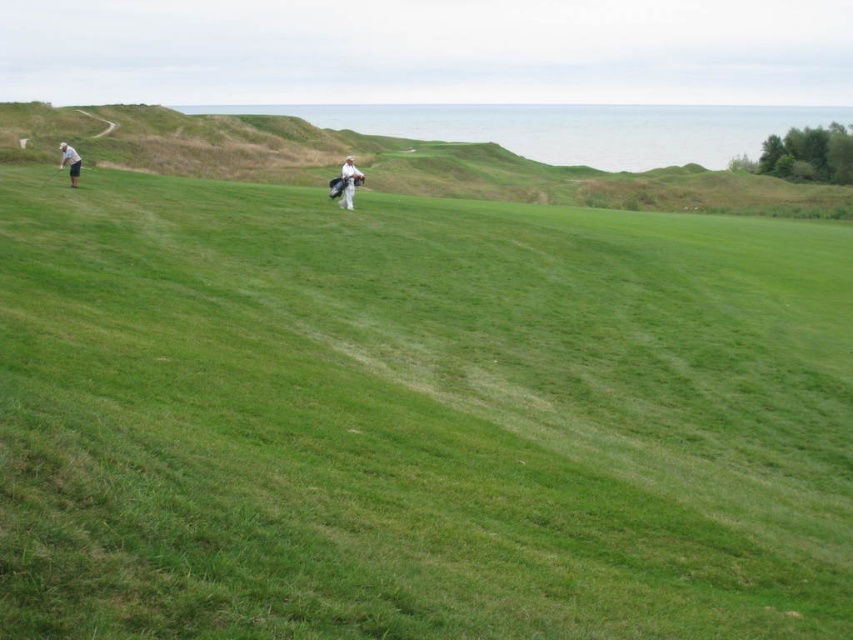
Question: Is green grassy hillside at upper left bigger than white matte golf bag at center?

Choices:
 (A) yes
 (B) no

Answer: (A)

Question: Which of these objects is positioned closest to the green grassy hillside at upper left?

Choices:
 (A) green grassy at center
 (B) white matte golf club at left
 (C) white matte golf bag at center

Answer: (C)

Question: Does green grassy at center appear on the right side of white matte golf bag at center?

Choices:
 (A) no
 (B) yes

Answer: (B)

Question: Is green grassy hillside at upper left in front of white matte golf bag at center?

Choices:
 (A) yes
 (B) no

Answer: (B)

Question: Among these points, which one is farthest from the camera?

Choices:
 (A) (360, 371)
 (B) (218, 176)
 (C) (341, 200)
 (D) (68, 154)

Answer: (B)

Question: Which of the following is the closest to the observer?

Choices:
 (A) white matte golf bag at center
 (B) green grassy at center
 (C) green grassy hillside at upper left

Answer: (B)